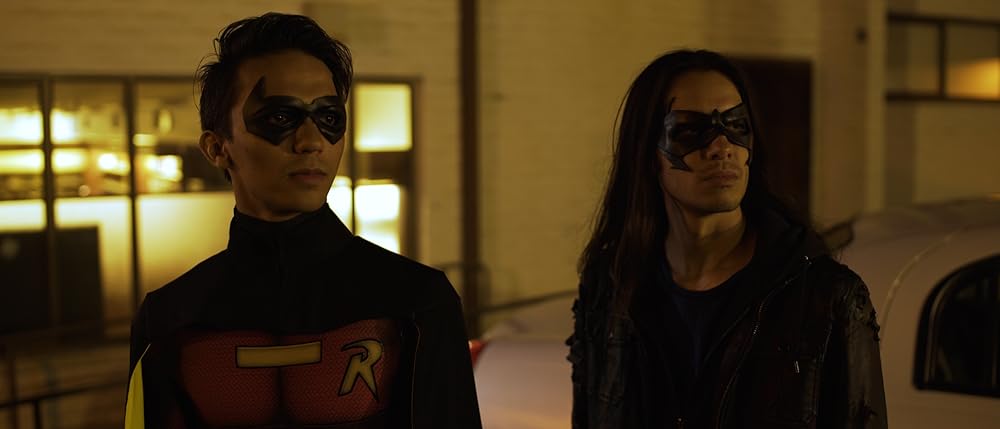
What are the coordinates of `window` in the screenshot? It's located at (159, 163).